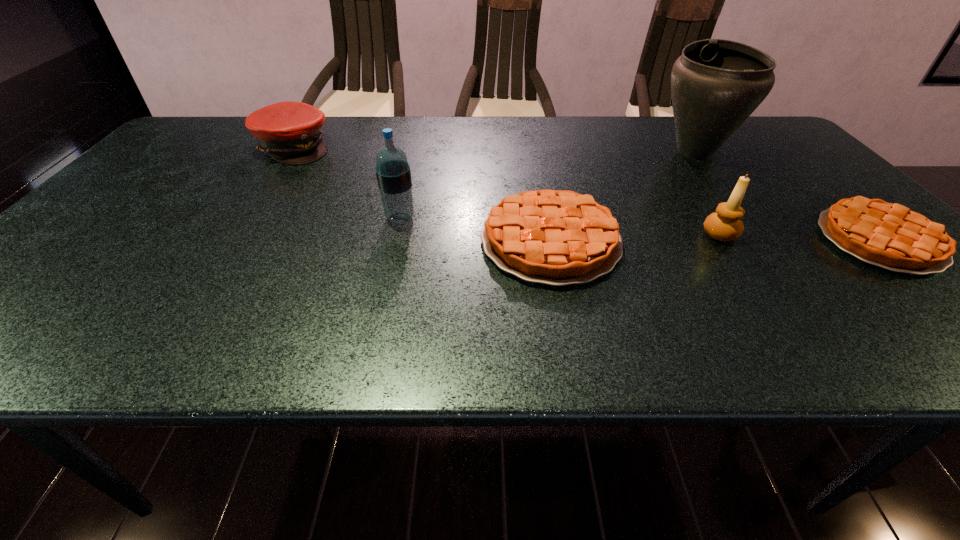
Locate an element on the screen. This screenshot has width=960, height=540. object that is the third nearest to the leftmost object is located at coordinates (716, 84).

This screenshot has height=540, width=960. What are the coordinates of `free space that satisfies the following two spatial constraints: 1. on the back side of the fourth shortest object; 2. at the front of the leftmost object where the visor is located` in the screenshot? It's located at (663, 147).

This screenshot has width=960, height=540. I want to click on free space that satisfies the following two spatial constraints: 1. at the front of the leftmost object where the visor is located; 2. on the back side of the candle_holder, so click(236, 235).